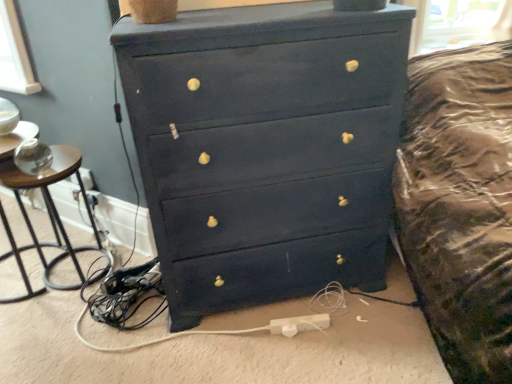
Question: In the image, is brown wood side table at left positioned in front of or behind white plastic extension cord at lower center?

Choices:
 (A) front
 (B) behind

Answer: (A)

Question: Is brown wood side table at left situated inside white plastic extension cord at lower center or outside?

Choices:
 (A) outside
 (B) inside

Answer: (A)

Question: Which object is positioned closest to the white plastic extension cord at lower center?

Choices:
 (A) matte black dresser at center
 (B) brown wood side table at left

Answer: (A)

Question: Based on their relative distances, which object is farther from the matte black dresser at center?

Choices:
 (A) white plastic extension cord at lower center
 (B) brown wood side table at left

Answer: (B)